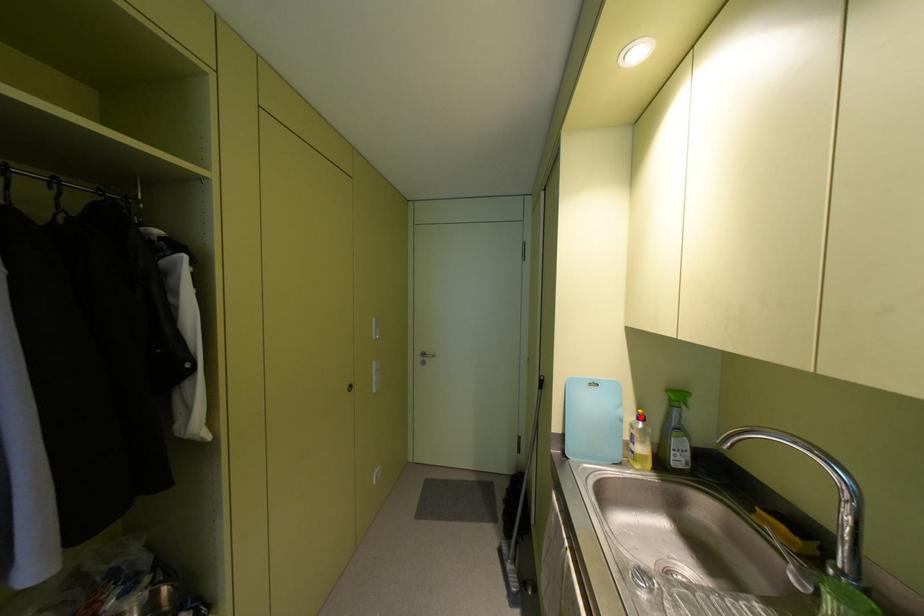
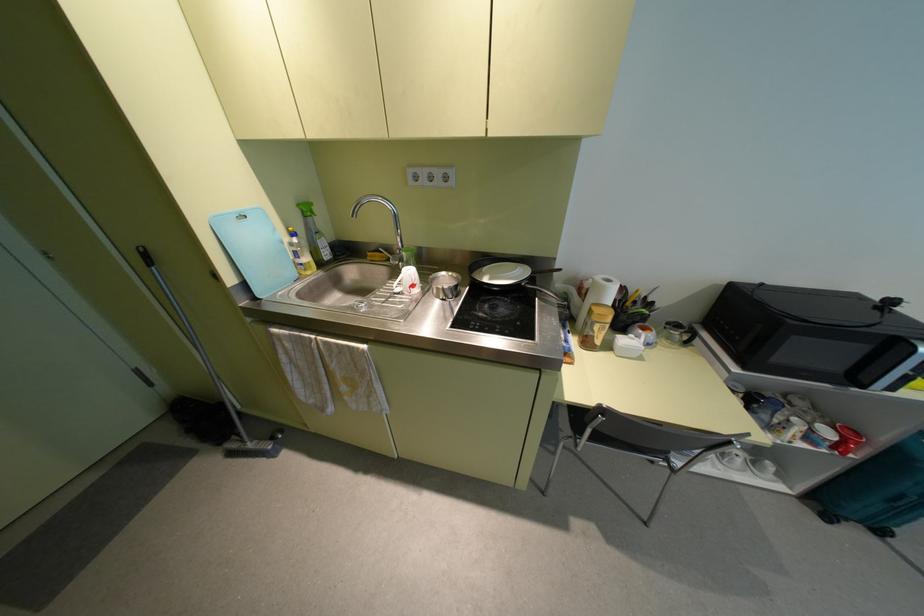
Question: I am providing you with two images of the same scene from different viewpoints. Image1 has a red point marked. In image2, the corresponding 3D location appears at what relative position? Reply with the corresponding letter.

Choices:
 (A) Closer
 (B) Farther

Answer: (A)